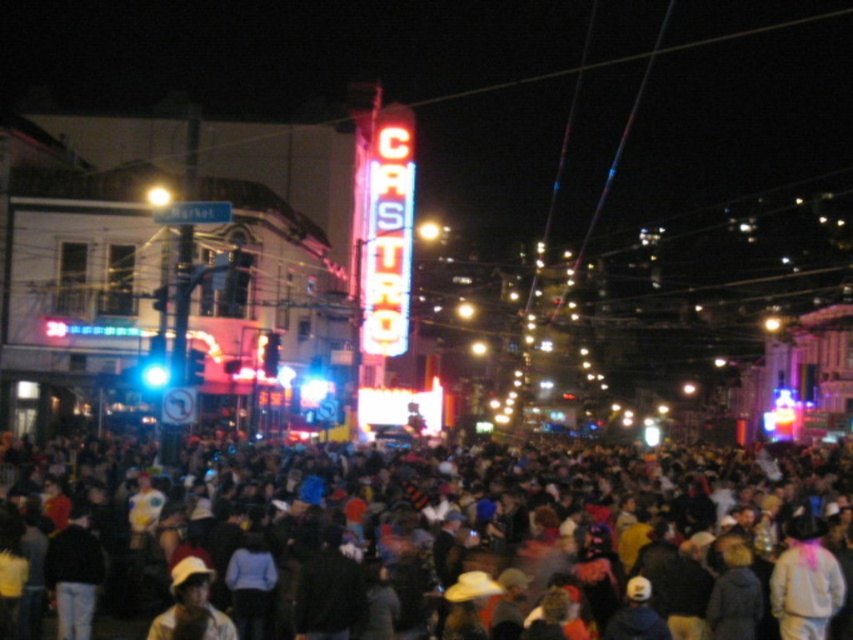
Can you confirm if multicolored fabric crowd at center is thinner than neon sign at center?

No, multicolored fabric crowd at center is not thinner than neon sign at center.

Measure the distance between multicolored fabric crowd at center and camera.

multicolored fabric crowd at center and camera are 166.95 feet apart from each other.

I want to click on multicolored fabric crowd at center, so click(497, 545).